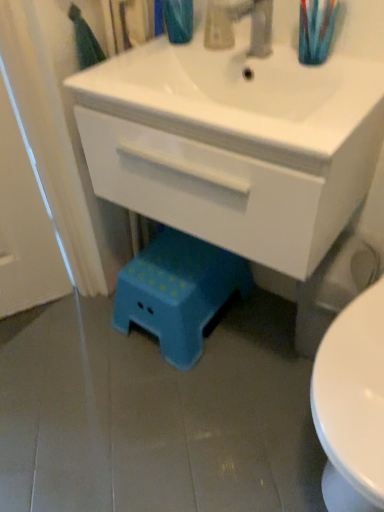
Identify the location of vacant space underneath white glossy cabinet at center (from a real-world perspective). (259, 343).